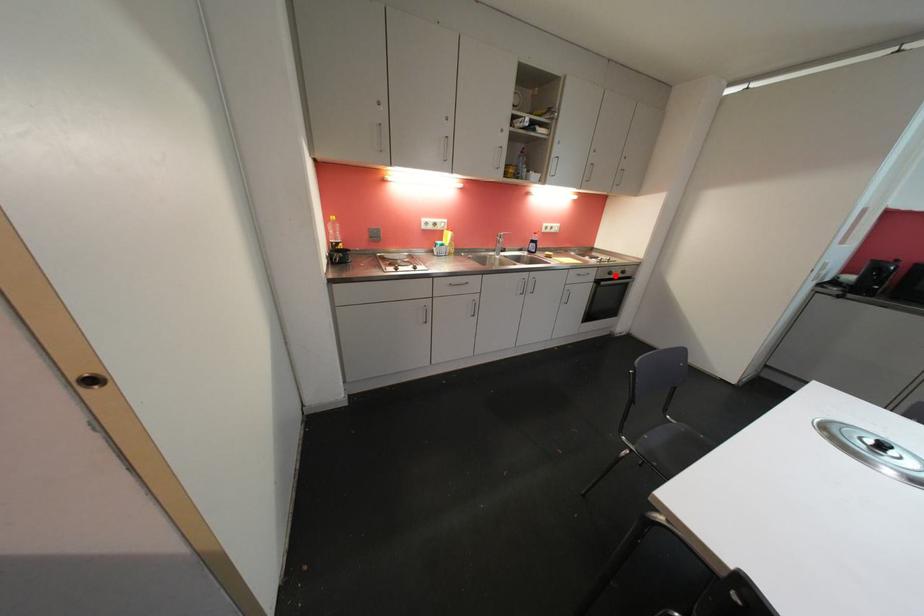
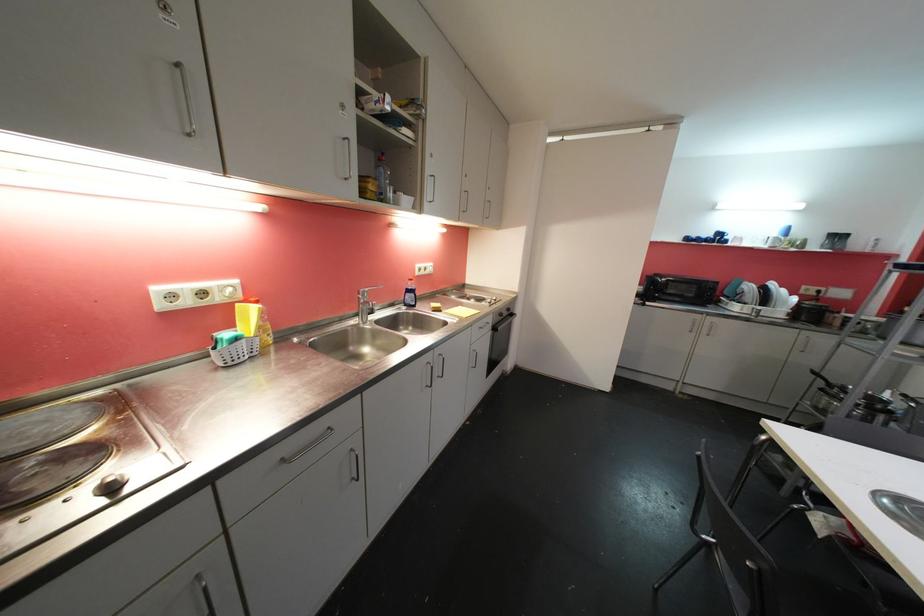
Find the pixel in the second image that matches the highlighted location in the first image.

(505, 317)